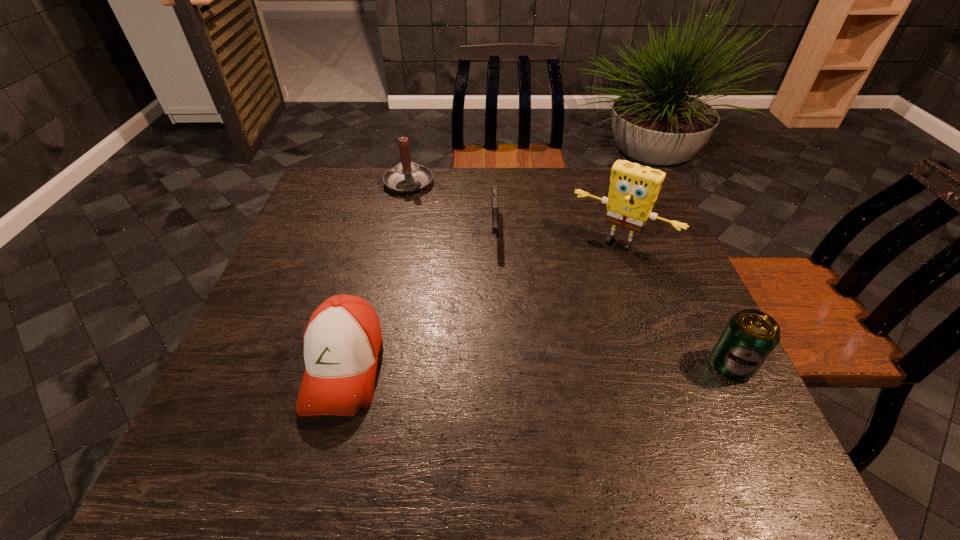
At what (x,y) coordinates should I click in order to perform the action: click on free space located on the side of the second tallest object with the handle loop. Please return your answer as a coordinate pair (x, y). Looking at the image, I should click on (428, 215).

Identify the location of vacant point located at the muzzle end of the gun. (496, 315).

Locate an element on the screen. vacant space positioned at the muzzle end of the gun is located at coordinates (496, 319).

Locate an element on the screen. This screenshot has width=960, height=540. free space located 0.060m at the muzzle end of the gun is located at coordinates (496, 267).

Find the location of a particular element. vacant region located on the face of the sponge is located at coordinates (582, 285).

Image resolution: width=960 pixels, height=540 pixels. I want to click on vacant space located on the face of the sponge, so click(553, 328).

The width and height of the screenshot is (960, 540). Find the location of `blank area located on the face of the sponge`. blank area located on the face of the sponge is located at coordinates (561, 316).

I want to click on candle that is at the far edge, so click(406, 177).

Identify the location of gun that is at the far edge. The height and width of the screenshot is (540, 960). (494, 194).

The image size is (960, 540). What are the coordinates of `baseball cap that is at the near edge` in the screenshot? It's located at (342, 341).